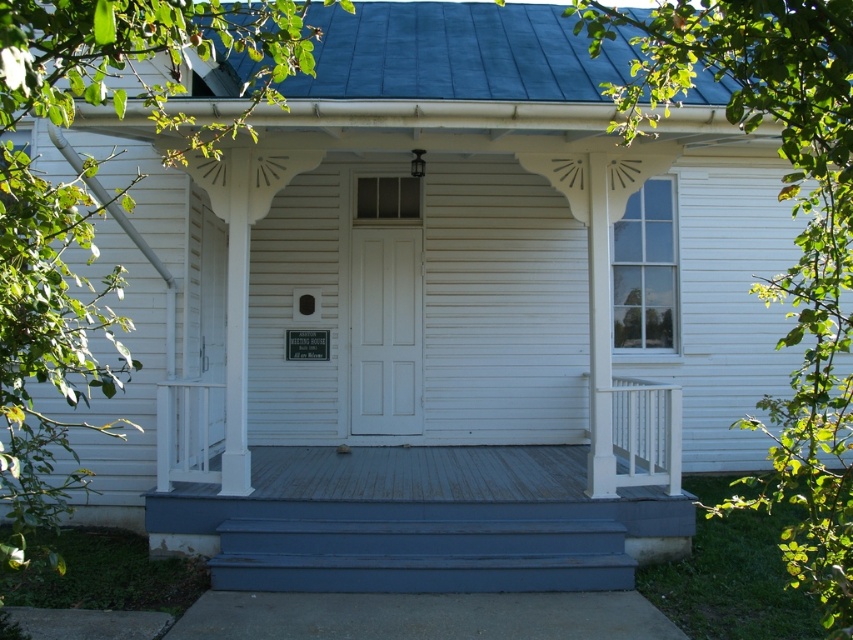
Question: Does blue painted wood stairs at lower center have a lesser width compared to white painted wood door at center?

Choices:
 (A) yes
 (B) no

Answer: (B)

Question: Does blue painted wood stairs at lower center have a smaller size compared to white painted wood door at center?

Choices:
 (A) no
 (B) yes

Answer: (A)

Question: Does blue painted wood stairs at lower center appear over white painted wood door at center?

Choices:
 (A) yes
 (B) no

Answer: (B)

Question: Among these objects, which one is nearest to the camera?

Choices:
 (A) blue painted wood stairs at lower center
 (B) white painted wood door at center

Answer: (A)